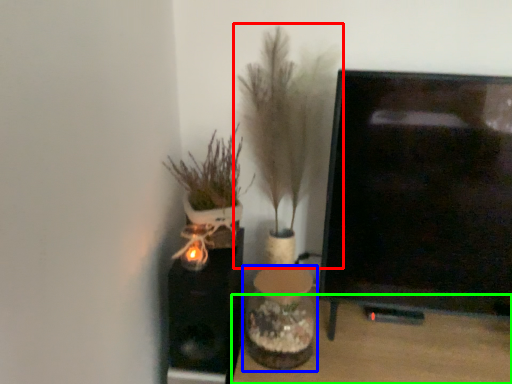
Question: Based on their relative distances, which object is farther from houseplant (highlighted by a red box)? Choose from vase (highlighted by a blue box) and furniture (highlighted by a green box).

Choices:
 (A) vase
 (B) furniture

Answer: (B)